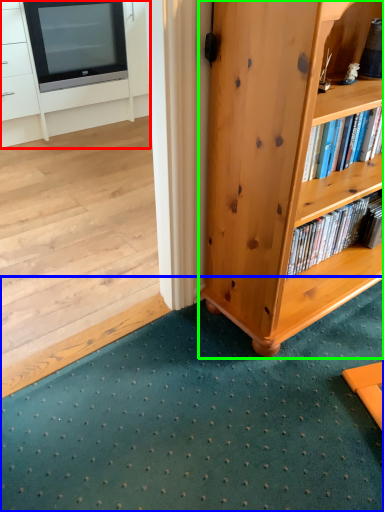
Question: Which object is positioned farthest from cabinetry (highlighted by a red box)? Select from doormat (highlighted by a blue box) and bookcase (highlighted by a green box).

Choices:
 (A) doormat
 (B) bookcase

Answer: (A)